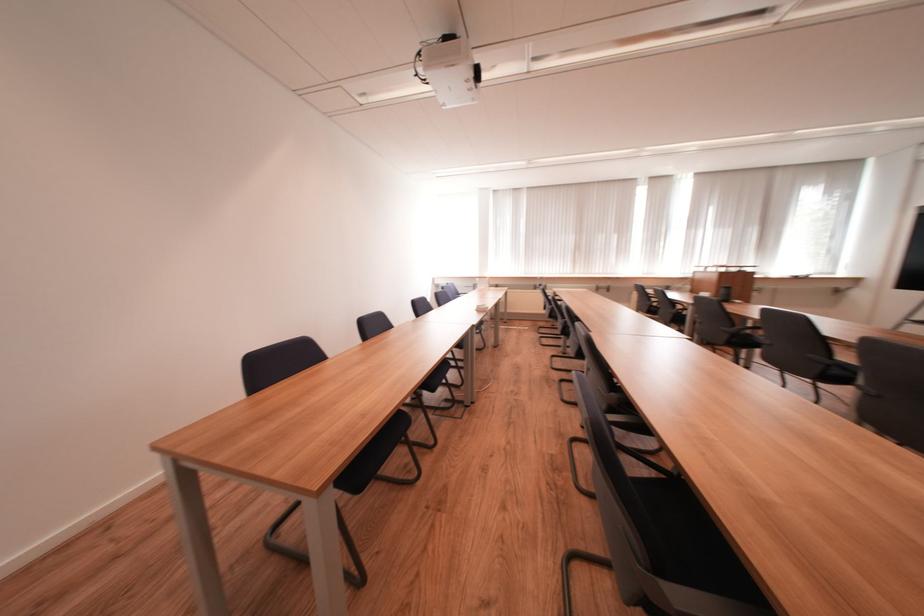
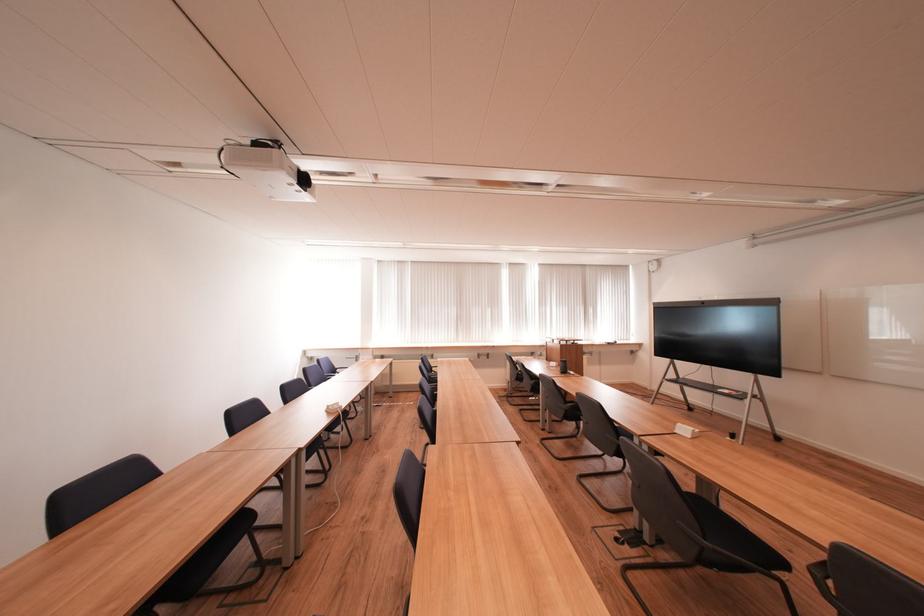
Question: The images are taken continuously from a first-person perspective. In which direction are you moving?

Choices:
 (A) Left
 (B) Right
 (C) Forward
 (D) Backward

Answer: (B)